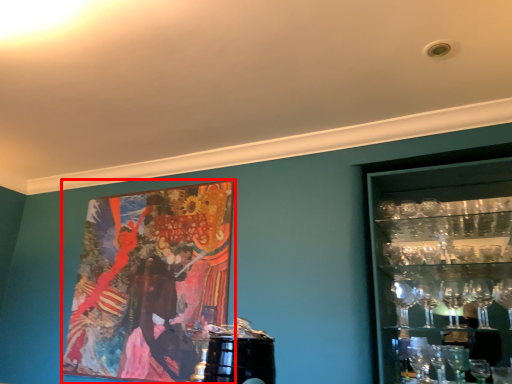
Question: Where is picture frame (annotated by the red box) located in relation to shelf in the image?

Choices:
 (A) right
 (B) left

Answer: (B)